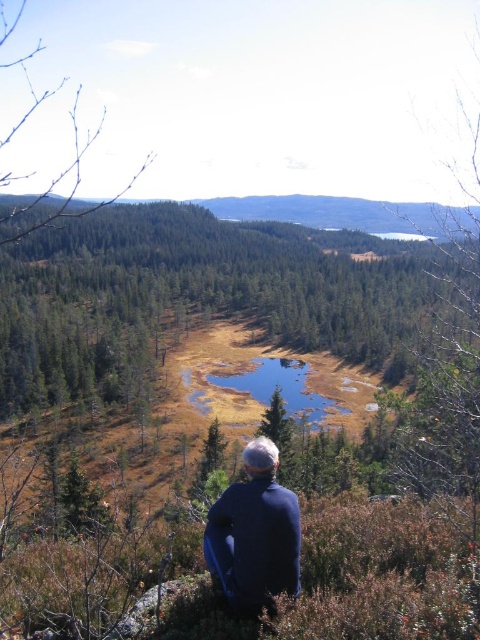
You are planning to take a photo of the clear water at center and the blue fleece jacket at lower center from a distance. Which object will appear smaller in the photo?

The blue fleece jacket at lower center will appear smaller in the photo because it has a lesser width compared to the clear water at center.

You are a hiker who wants to take a photo of the clear water at center without the blue fleece jacket at lower center blocking the view. Is the jacket too tall to block the view of the water from your current position?

The blue fleece jacket at lower center has a lesser height compared to clear water at center, so the jacket is shorter than the water. However, since the jacket is at the lower center and the water is at the center, the jacket might still block the view depending on the angle. To ensure the jacket doesn

You are a hiker who wants to cross the clear water at center without getting your shoes wet. Is the blue fleece jacket at lower center in a position that could help you determine if the water is shallow enough to walk across?

The blue fleece jacket at lower center is positioned over clear water at center, indicating that the water is shallow enough for the jacket to be visible above the surface. This suggests that the water depth there is not too deep, so you might be able to cross without getting your shoes wet.